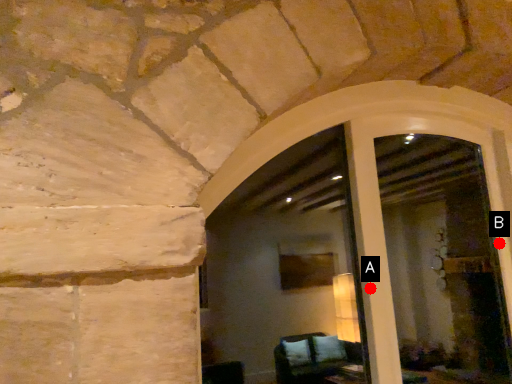
Question: Two points are circled on the image, labeled by A and B beside each circle. Which point is farther to the camera?

Choices:
 (A) A is further
 (B) B is further

Answer: (B)